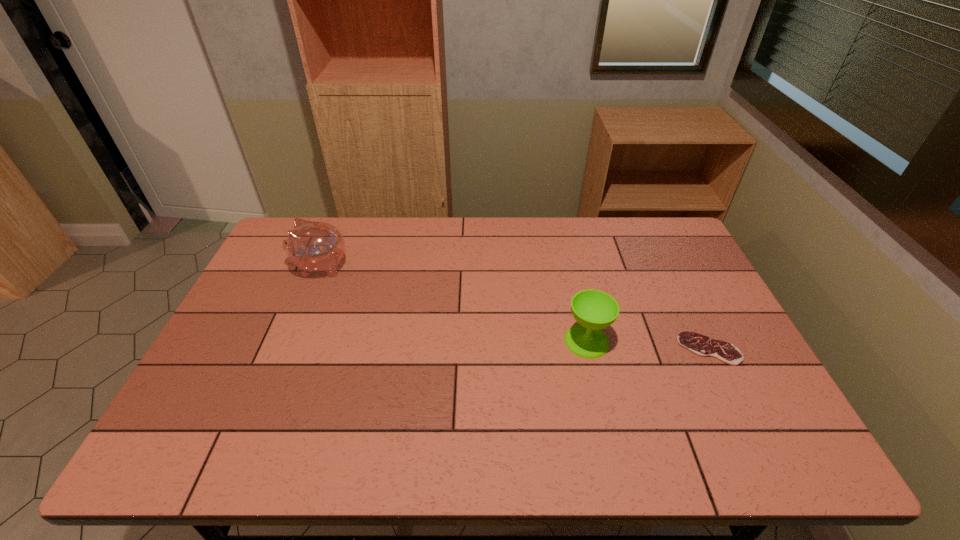
Where is `object that is at the far edge`? The width and height of the screenshot is (960, 540). object that is at the far edge is located at coordinates (312, 246).

Identify the location of object that is at the left edge. Image resolution: width=960 pixels, height=540 pixels. (312, 246).

Locate an element on the screen. This screenshot has height=540, width=960. object present at the right edge is located at coordinates (699, 344).

Identify the location of object that is positioned at the far left corner. The image size is (960, 540). (312, 246).

In the image, there is a desktop. At what (x,y) coordinates should I click in order to perform the action: click on free space at the far edge. Please return your answer as a coordinate pair (x, y). Image resolution: width=960 pixels, height=540 pixels. Looking at the image, I should click on (485, 258).

Find the location of a particular element. Image resolution: width=960 pixels, height=540 pixels. vacant space at the near edge of the desktop is located at coordinates (600, 456).

This screenshot has width=960, height=540. I want to click on free space at the left edge of the desktop, so click(x=287, y=295).

The height and width of the screenshot is (540, 960). Identify the location of vacant region at the right edge. (687, 356).

This screenshot has height=540, width=960. In order to click on free space between the shortest object and the wineglass in this screenshot , I will do `click(648, 345)`.

This screenshot has width=960, height=540. In order to click on free space between the second tallest object and the tallest object in this screenshot , I will do (453, 303).